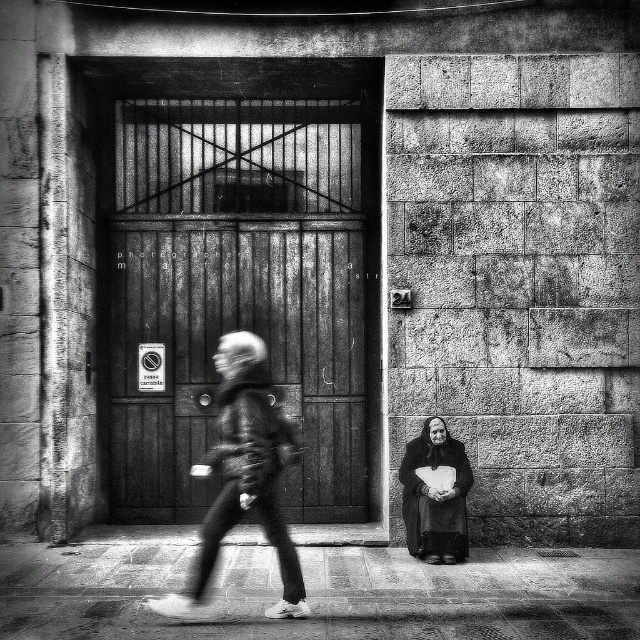
Question: Can you confirm if wooden door at center is positioned to the right of gray textured jacket at center?

Choices:
 (A) no
 (B) yes

Answer: (A)

Question: Which of the following is the closest to the observer?

Choices:
 (A) dark gray fabric at lower right
 (B) gray textured jacket at center
 (C) wooden door at center

Answer: (B)

Question: Which point is farther from the camera taking this photo?

Choices:
 (A) (209, 552)
 (B) (115, 516)
 (C) (454, 541)

Answer: (B)

Question: Is wooden door at center bigger than gray textured jacket at center?

Choices:
 (A) no
 (B) yes

Answer: (A)

Question: Is gray textured jacket at center further to camera compared to dark gray fabric at lower right?

Choices:
 (A) yes
 (B) no

Answer: (B)

Question: Which point is farther to the camera?

Choices:
 (A) gray textured jacket at center
 (B) wooden door at center

Answer: (B)